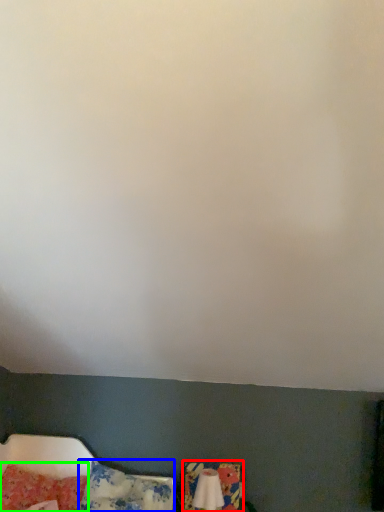
Question: Which object is the farthest from swivel chair (highlighted by a red box)? Choose among these: pillow (highlighted by a blue box) or pillow (highlighted by a green box).

Choices:
 (A) pillow
 (B) pillow

Answer: (B)